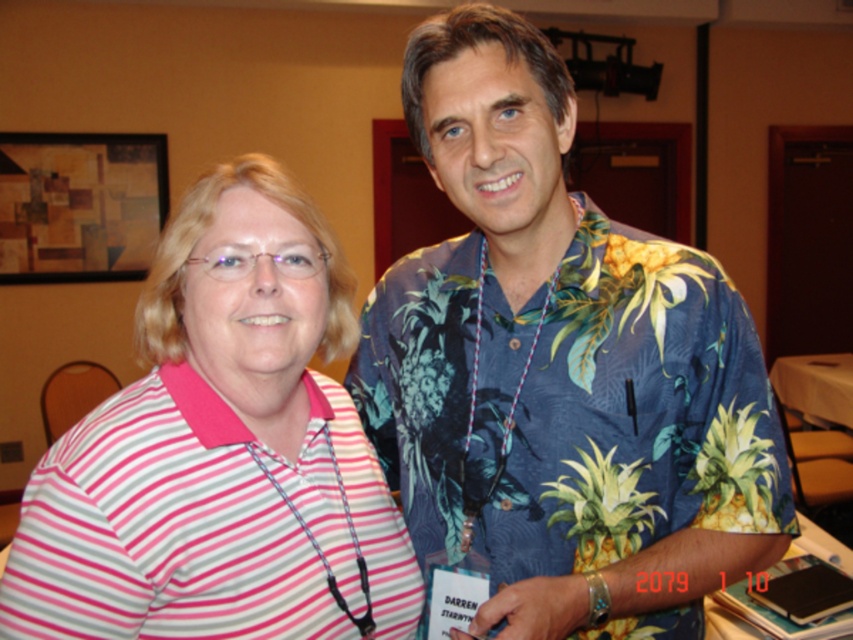
Is point (651, 392) positioned after point (135, 486)?

Yes, it is.

Where is `blue floral shirt at center`? This screenshot has height=640, width=853. blue floral shirt at center is located at coordinates (560, 371).

Where is `blue floral shirt at center`? Image resolution: width=853 pixels, height=640 pixels. blue floral shirt at center is located at coordinates (560, 371).